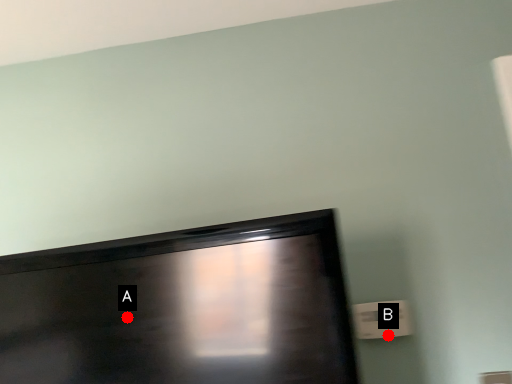
Question: Two points are circled on the image, labeled by A and B beside each circle. Which point is farther from the camera taking this photo?

Choices:
 (A) A is further
 (B) B is further

Answer: (B)